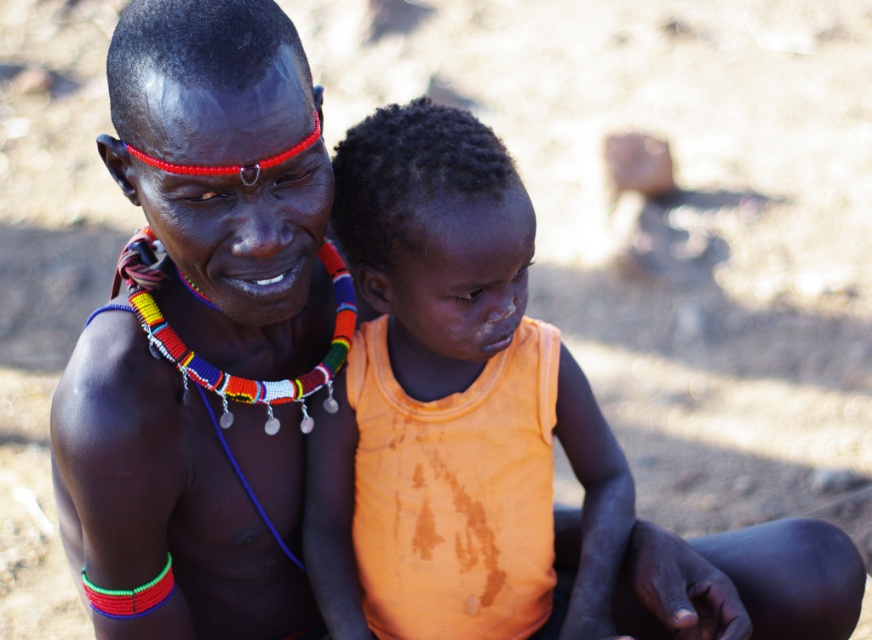
Question: Is matte black face paint at center thinner than orange fabric shirt at center?

Choices:
 (A) yes
 (B) no

Answer: (A)

Question: Which point appears closest to the camera in this image?

Choices:
 (A) pyautogui.click(x=60, y=465)
 (B) pyautogui.click(x=345, y=232)

Answer: (A)

Question: Which object appears closest to the camera in this image?

Choices:
 (A) matte black face paint at center
 (B) orange fabric shirt at center

Answer: (A)

Question: Can you confirm if matte black face paint at center is positioned to the left of orange fabric shirt at center?

Choices:
 (A) yes
 (B) no

Answer: (A)

Question: Does matte black face paint at center have a smaller size compared to orange fabric shirt at center?

Choices:
 (A) no
 (B) yes

Answer: (A)